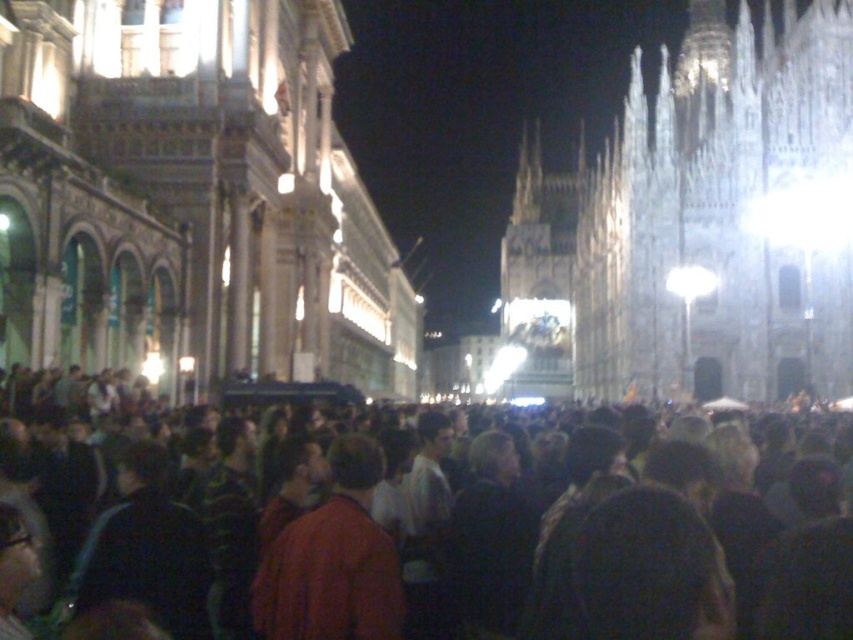
Question: Which is nearer to the dark matte crowd at center?

Choices:
 (A) red matte jacket at center
 (B) white stone church at upper right
 (C) stone church at center

Answer: (A)

Question: Can you confirm if stone church at center is positioned below red matte jacket at center?

Choices:
 (A) yes
 (B) no

Answer: (B)

Question: Is dark matte crowd at center thinner than red matte jacket at center?

Choices:
 (A) yes
 (B) no

Answer: (B)

Question: Which point is closer to the camera?

Choices:
 (A) (x=399, y=586)
 (B) (x=689, y=307)
 (C) (x=129, y=134)

Answer: (A)

Question: Can you confirm if stone church at center is smaller than white stone church at upper right?

Choices:
 (A) no
 (B) yes

Answer: (B)

Question: Which object is farther from the camera taking this photo?

Choices:
 (A) stone church at center
 (B) white stone church at upper right
 (C) dark matte crowd at center

Answer: (B)